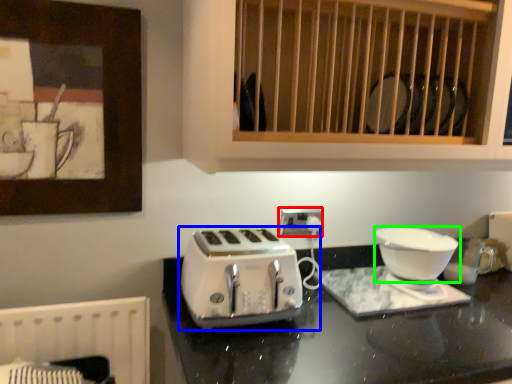
Question: Which is farther away from electric outlet (highlighted by a red box)? toaster (highlighted by a blue box) or kitchen appliance (highlighted by a green box)?

Choices:
 (A) toaster
 (B) kitchen appliance

Answer: (B)